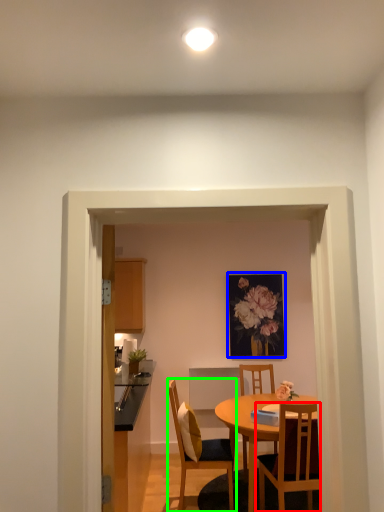
Question: Based on their relative distances, which object is farther from chair (highlighted by a red box)? Choose from picture frame (highlighted by a blue box) and chair (highlighted by a green box).

Choices:
 (A) picture frame
 (B) chair

Answer: (A)